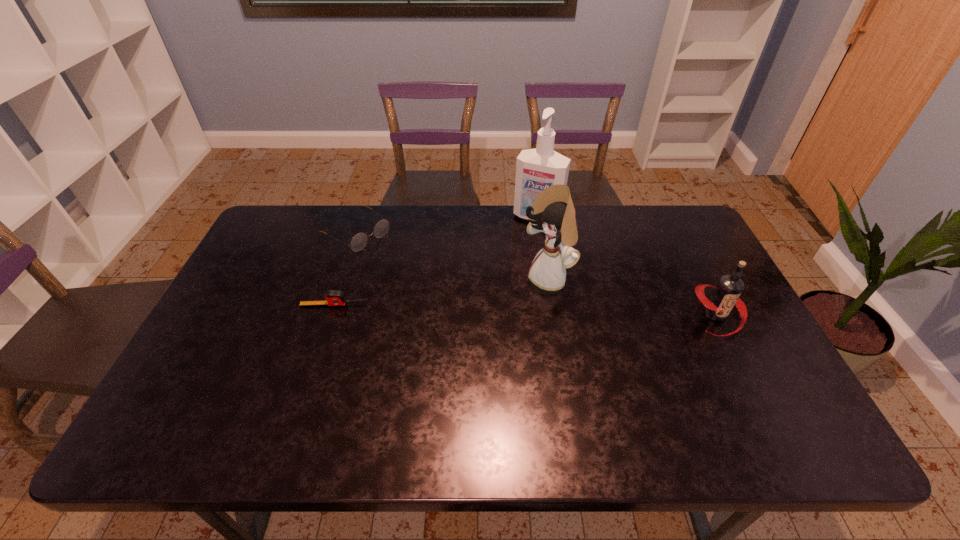
This screenshot has height=540, width=960. Identify the location of vacant region at the far edge. (625, 216).

Locate an element on the screen. The image size is (960, 540). vacant area at the near edge is located at coordinates (507, 406).

At what (x,y) coordinates should I click in order to perform the action: click on vacant region at the left edge. Please return your answer as a coordinate pair (x, y). This screenshot has width=960, height=540. Looking at the image, I should click on (231, 342).

Locate an element on the screen. vacant space at the right edge of the desktop is located at coordinates (773, 372).

Where is `vacant space at the far right corner`? The height and width of the screenshot is (540, 960). vacant space at the far right corner is located at coordinates (669, 217).

This screenshot has width=960, height=540. I want to click on blank region between the tape measure and the spectacles, so click(346, 268).

Locate an element on the screen. empty space that is in between the tallest object and the rightmost object is located at coordinates (627, 266).

The width and height of the screenshot is (960, 540). Identify the location of vacant space in between the tallest object and the third tallest object. (627, 266).

This screenshot has width=960, height=540. Find the location of `free point between the shortest object and the third tallest object`. free point between the shortest object and the third tallest object is located at coordinates (525, 309).

At what (x,y) coordinates should I click in order to perform the action: click on vacant space that is in between the tape measure and the spectacles. Please return your answer as a coordinate pair (x, y). The image size is (960, 540). Looking at the image, I should click on (346, 268).